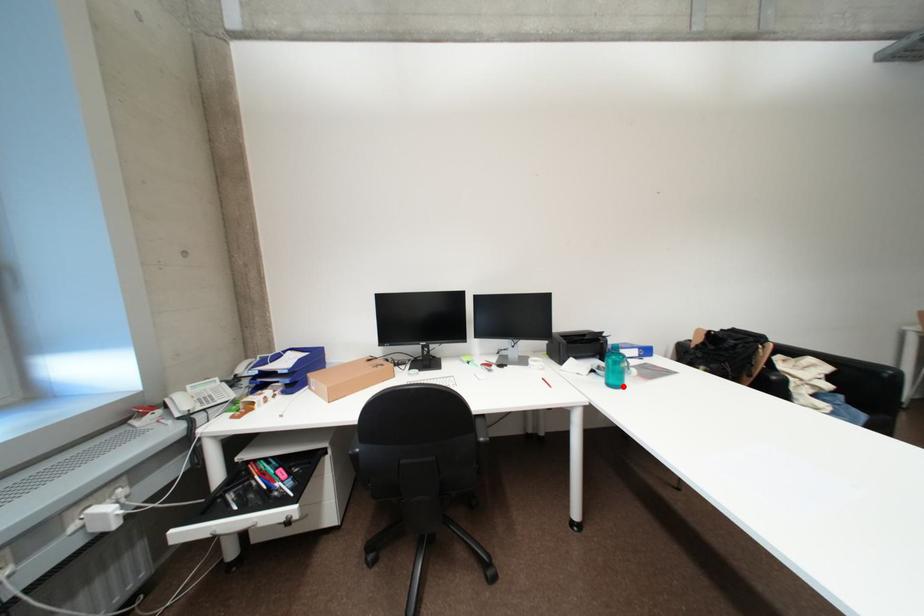
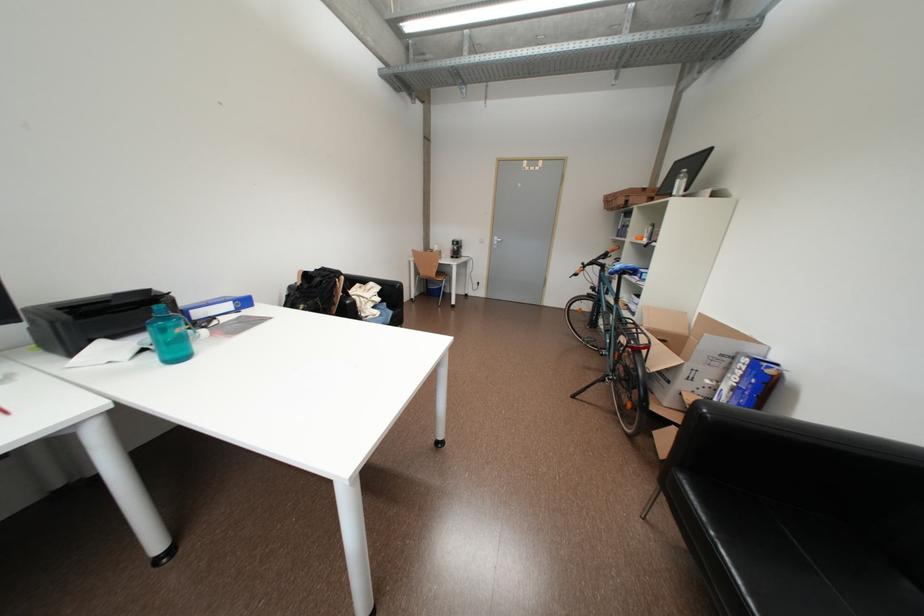
In the second image, find the point that corresponds to the highlighted location in the first image.

(186, 360)